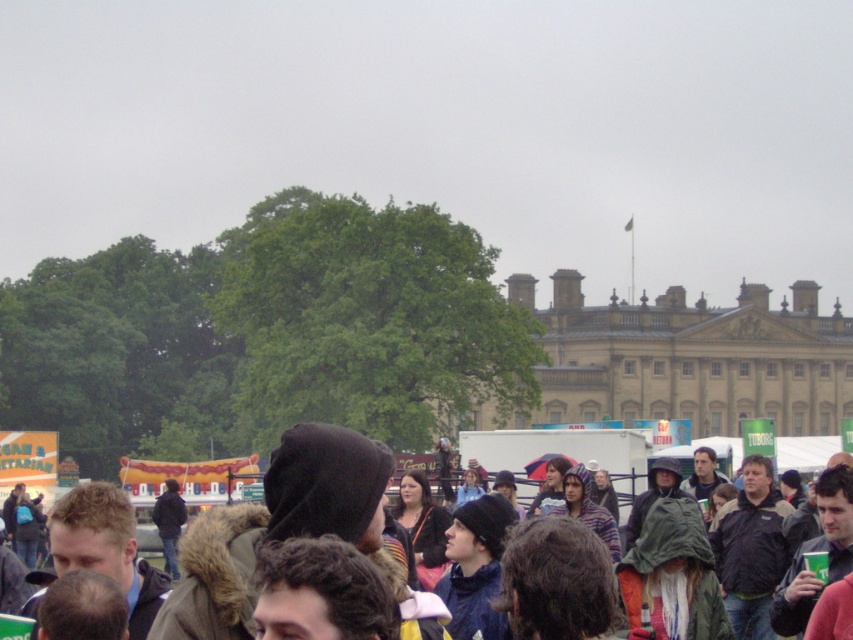
Can you confirm if beige stone building at center is positioned below dark brown hood at center?

No.

Does beige stone building at center have a smaller size compared to dark brown hood at center?

Actually, beige stone building at center might be larger than dark brown hood at center.

In order to click on beige stone building at center in this screenshot , I will do `click(691, 358)`.